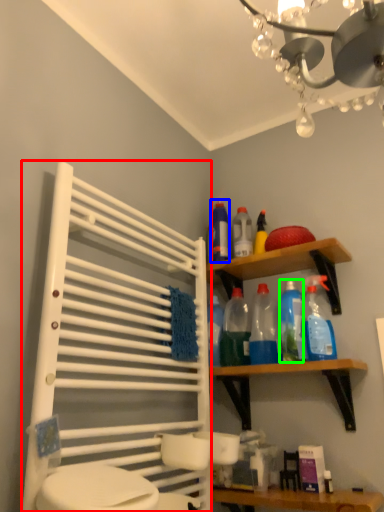
Question: Which object is positioned farthest from cabinet (highlighted by a red box)? Select from cleaning product (highlighted by a blue box) and cleaning product (highlighted by a green box).

Choices:
 (A) cleaning product
 (B) cleaning product

Answer: (A)